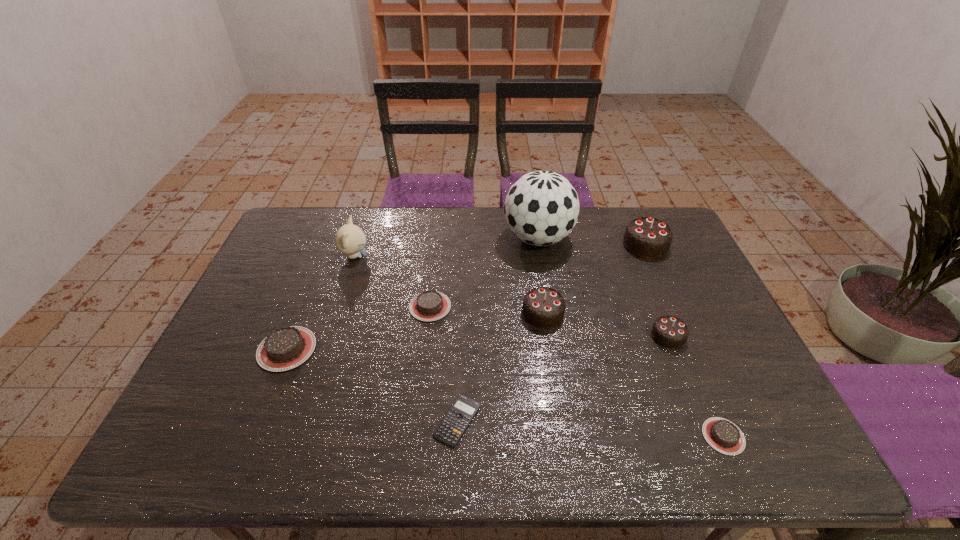
Locate an element on the screen. This screenshot has width=960, height=540. free space between the leftmost brown chocolate cake and the fourth shortest chocolate cake is located at coordinates 477,343.

I want to click on free space that is in between the kitten and the fourth chocolate cake from right to left, so click(x=448, y=285).

The width and height of the screenshot is (960, 540). I want to click on vacant space that is in between the second brown chocolate cake from left to right and the leftmost chocolate cake, so click(x=358, y=328).

Where is `vacant area between the kitten and the leftmost chocolate cake`? This screenshot has height=540, width=960. vacant area between the kitten and the leftmost chocolate cake is located at coordinates (321, 302).

The width and height of the screenshot is (960, 540). I want to click on free space between the third tallest chocolate cake and the smallest brown chocolate cake, so click(696, 386).

Image resolution: width=960 pixels, height=540 pixels. What are the coordinates of `free space between the leftmost chocolate cake and the farthest brown chocolate cake` in the screenshot? It's located at pyautogui.click(x=358, y=328).

Identify which object is the third closest to the nearest chocolate cake. Please provide its 2D coordinates. Your answer should be formatted as a tuple, i.e. [(x, y)], where the tuple contains the x and y coordinates of a point satisfying the conditions above.

[(449, 431)]

Identify the location of object that ranks as the seventh closest to the eighth tallest object. This screenshot has width=960, height=540. (285, 348).

Locate which chocolate cake is the fifth closest to the second brown chocolate cake from left to right. Please provide its 2D coordinates. Your answer should be formatted as a tuple, i.e. [(x, y)], where the tuple contains the x and y coordinates of a point satisfying the conditions above.

[(724, 436)]

What are the coordinates of `chocolate cake object that ranks as the fifth closest to the black soccer ball` in the screenshot? It's located at click(724, 436).